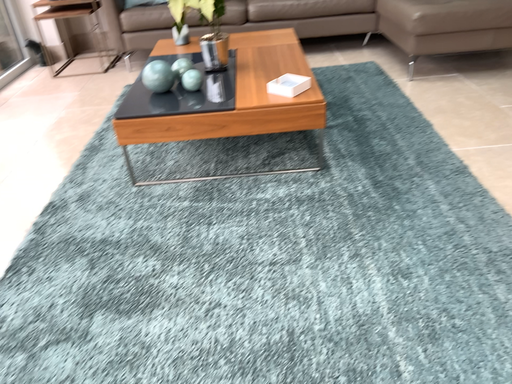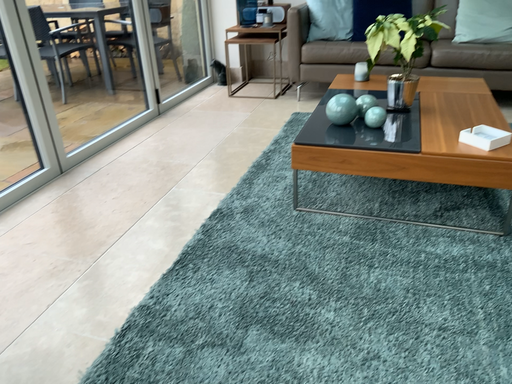
Question: Which way did the camera rotate in the video?

Choices:
 (A) rotated right
 (B) rotated left

Answer: (B)